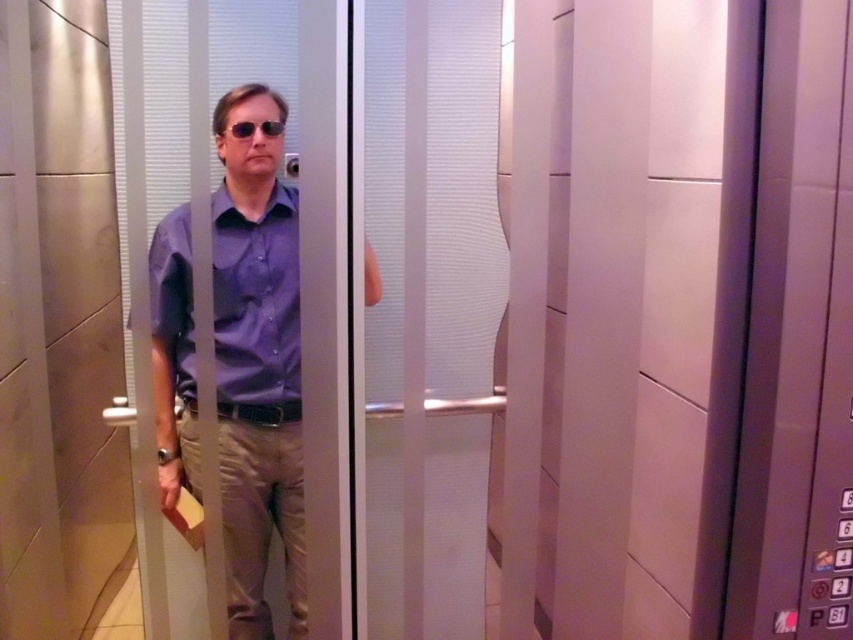
Question: Which point is farther to the camera?

Choices:
 (A) purple shirt at center
 (B) matte black sunglasses at center

Answer: (B)

Question: Estimate the real-world distances between objects in this image. Which object is farther from the matte black sunglasses at center?

Choices:
 (A) purple shirt at center
 (B) purple smooth shirt at center

Answer: (A)

Question: Which object appears closest to the camera in this image?

Choices:
 (A) matte black sunglasses at center
 (B) purple smooth shirt at center

Answer: (B)

Question: Is purple smooth shirt at center to the right of matte black sunglasses at center from the viewer's perspective?

Choices:
 (A) yes
 (B) no

Answer: (B)

Question: Is purple shirt at center positioned at the back of purple smooth shirt at center?

Choices:
 (A) yes
 (B) no

Answer: (B)

Question: Can you confirm if purple shirt at center is thinner than purple smooth shirt at center?

Choices:
 (A) yes
 (B) no

Answer: (B)